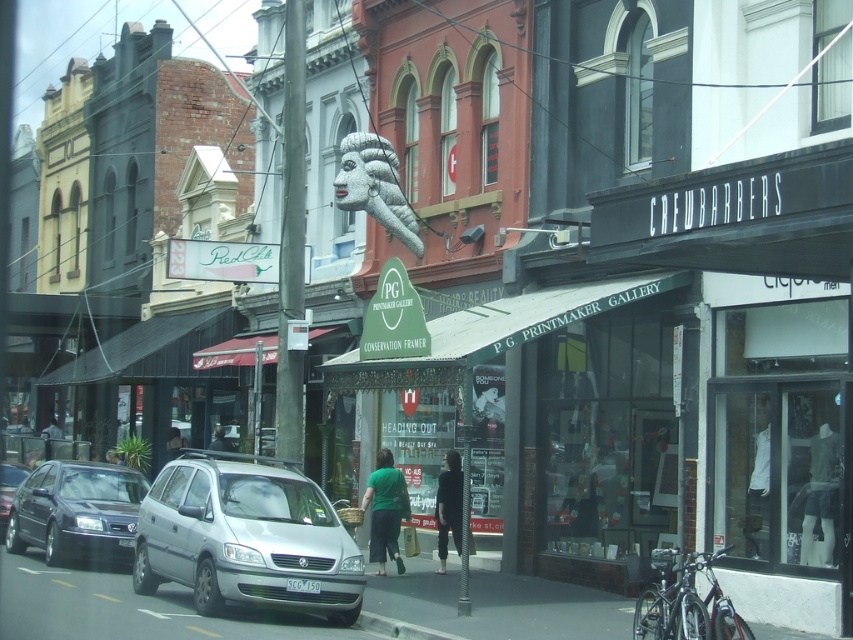
You are a delivery person who needs to place a package between the smooth gray pole at center and the dark green fabric jacket at center. Which object should you move to make space?

Since the smooth gray pole at center is larger in size than the dark green fabric jacket at center, you should move the dark green fabric jacket at center to make space for the package.

Based on the photo, you are a pedestrian standing on the sidewalk in the street scene. You see a dark gray fabric jacket at center and a green fabric person at center. Which one is closer to your left side?

The dark gray fabric jacket at center is closer to your left side because it is positioned to the left of the green fabric person at center.

You are a pedestrian standing on the sidewalk in the scene. You see a dark gray fabric jacket at center and a green fabric person at center. Which object is taller?

The dark gray fabric jacket at center is much taller than the green fabric person at center.